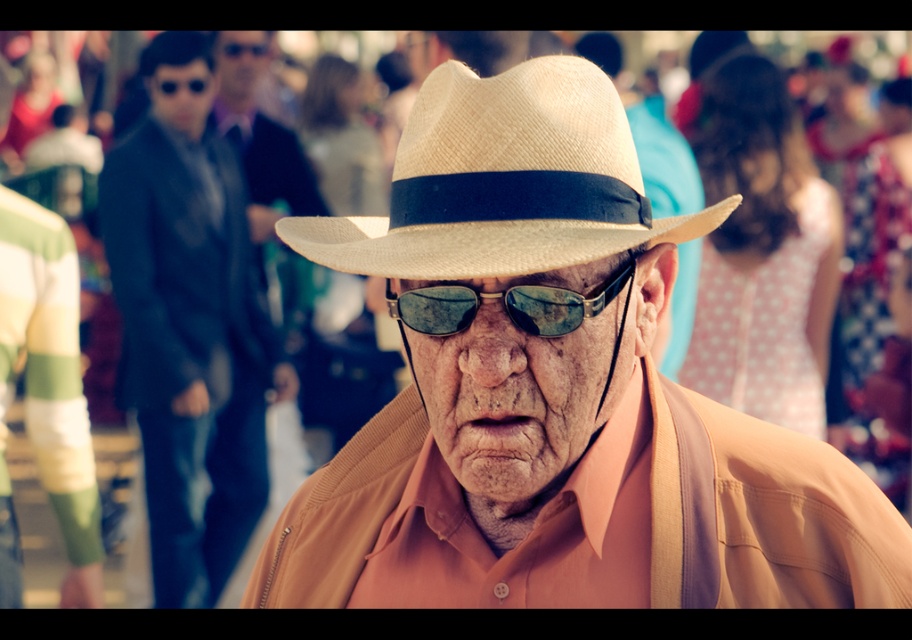
Which is in front, point (159, 390) or point (456, 323)?

Point (456, 323)

Does matte black jacket at left have a greater height compared to sunglasses at center?

Correct, matte black jacket at left is much taller as sunglasses at center.

Identify the location of matte black jacket at left. (190, 324).

Which is below, matte black jacket at left or natural straw hat at center?

matte black jacket at left is lower down.

Is matte black jacket at left wider than natural straw hat at center?

Yes.

Does point (173, 525) come in front of point (522, 195)?

That is False.

This screenshot has height=640, width=912. I want to click on matte black jacket at left, so [x=190, y=324].

Based on the photo, is matte straw hat at center thinner than matte black jacket at left?

Incorrect, matte straw hat at center's width is not less than matte black jacket at left's.

Is matte straw hat at center behind matte black jacket at left?

No.

Is point (859, 566) positioned after point (234, 298)?

No, (859, 566) is closer to viewer.

What are the coordinates of `matte straw hat at center` in the screenshot? It's located at (554, 394).